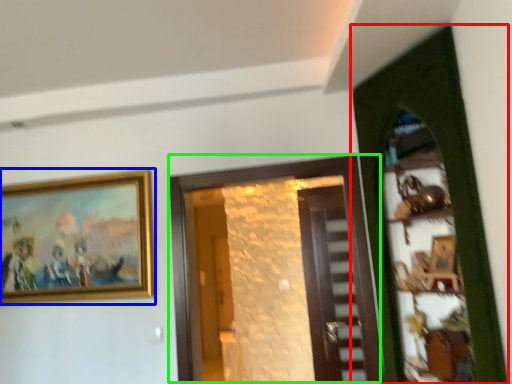
Question: Which object is the closest to the door (highlighted by a red box)? Choose among these: picture frame (highlighted by a blue box) or door (highlighted by a green box).

Choices:
 (A) picture frame
 (B) door

Answer: (B)